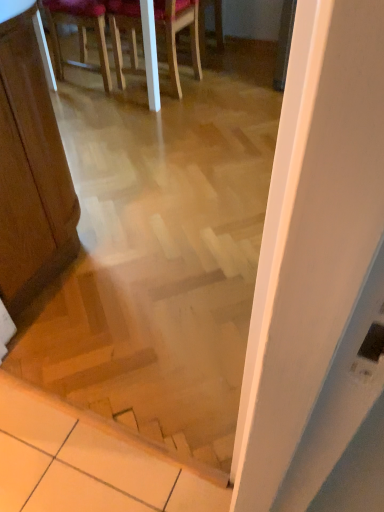
Identify the location of unoccupied area behind wooden stairs at center. This screenshot has width=384, height=512. (121, 310).